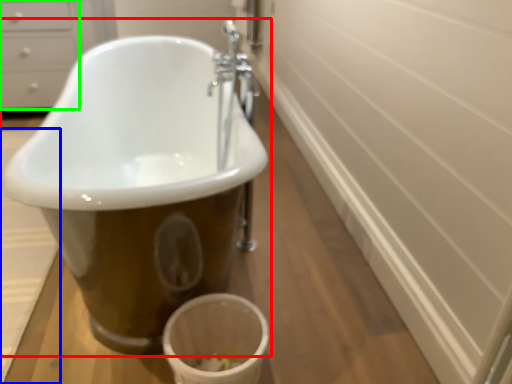
Question: Which object is positioned farthest from bathtub (highlighted by a red box)? Select from bath mat (highlighted by a blue box) and drawer (highlighted by a green box).

Choices:
 (A) bath mat
 (B) drawer

Answer: (B)